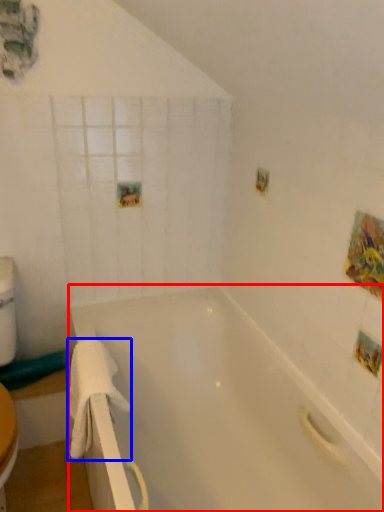
Question: Which point is closer to the camera, bathtub (highlighted by a red box) or towel/napkin (highlighted by a blue box)?

Choices:
 (A) bathtub
 (B) towel/napkin

Answer: (A)